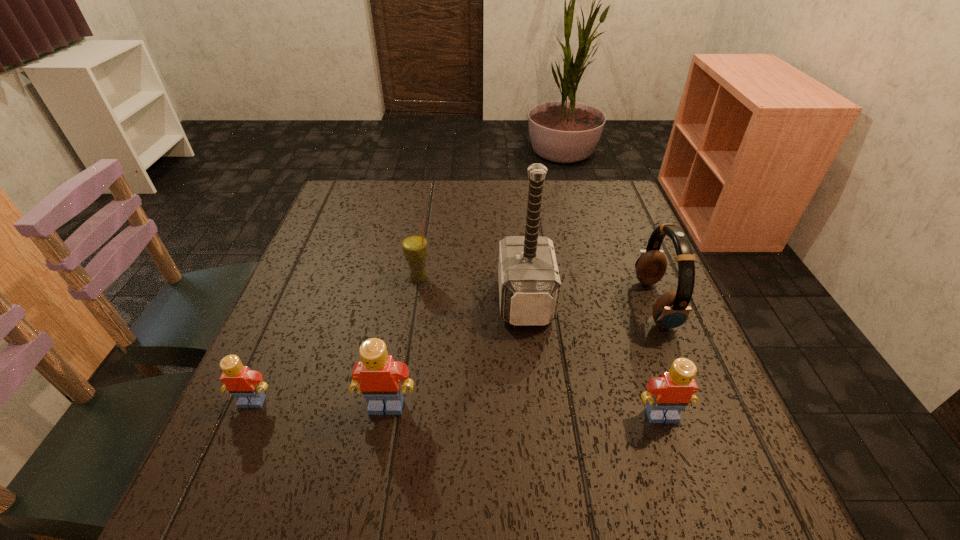
Please point a space for a new Lego to maintain equal intervals. Please provide its 2D coordinates. Your answer should be formatted as a tuple, i.e. [(x, y)], where the tuple contains the x and y coordinates of a point satisfying the conditions above.

[(523, 410)]